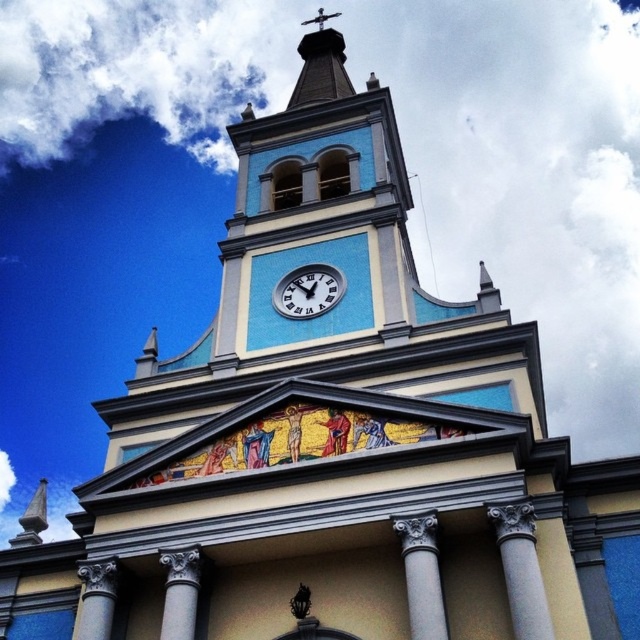
You are standing at a distance of 25 meters from the base of the tower. You want to reach the point marked as point (536, 604) on the tower. Is the point within your current reach?

The distance of point (536, 604) from viewer is 27.70 meters, so the point is 2.7 meters farther than your current position at 25 meters away from the tower. You cannot reach it without moving closer.

You are standing in front of the church tower and see the point marked at coordinates (420, 576). What object is located at that point?

The point at coordinates (420, 576) corresponds to the white marble column at lower center.